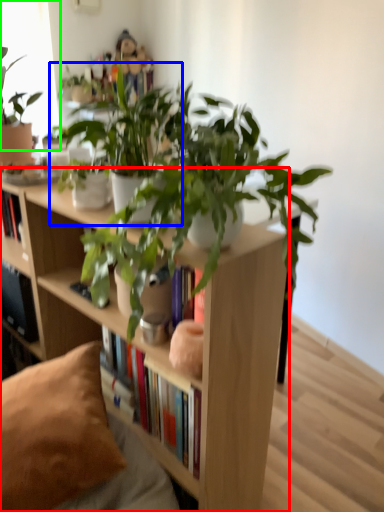
Question: Which object is positioned closest to bookcase (highlighted by a red box)? Select from houseplant (highlighted by a blue box) and window screen (highlighted by a green box).

Choices:
 (A) houseplant
 (B) window screen

Answer: (A)